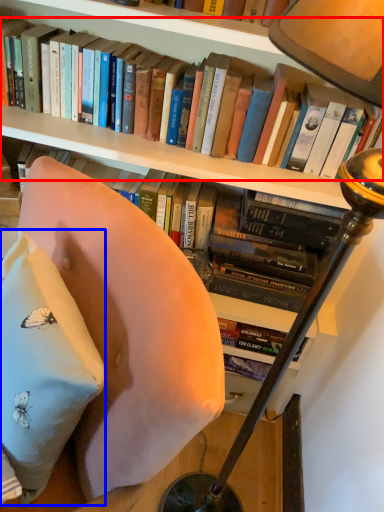
Question: Which point is closer to the camera, book (highlighted by a red box) or pillow (highlighted by a blue box)?

Choices:
 (A) book
 (B) pillow

Answer: (B)